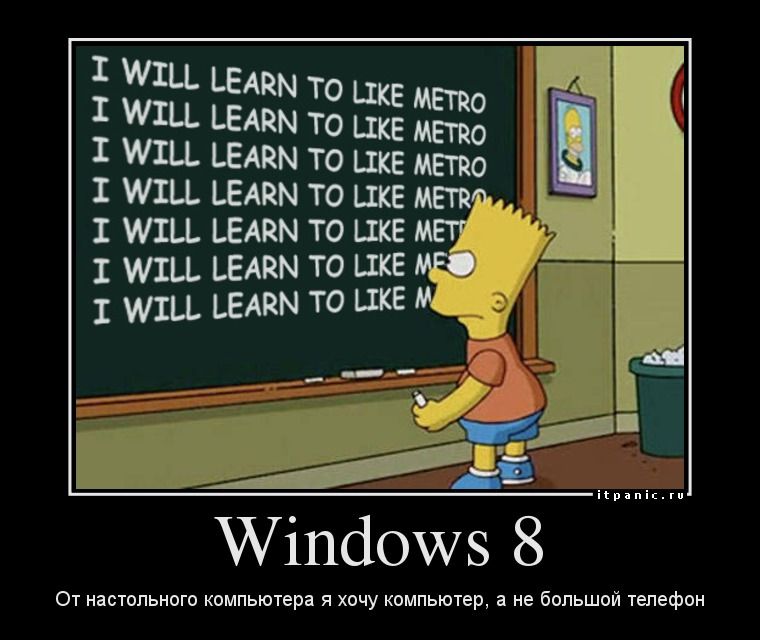
Where is `wall`? Image resolution: width=760 pixels, height=640 pixels. wall is located at coordinates (580, 228), (648, 221).